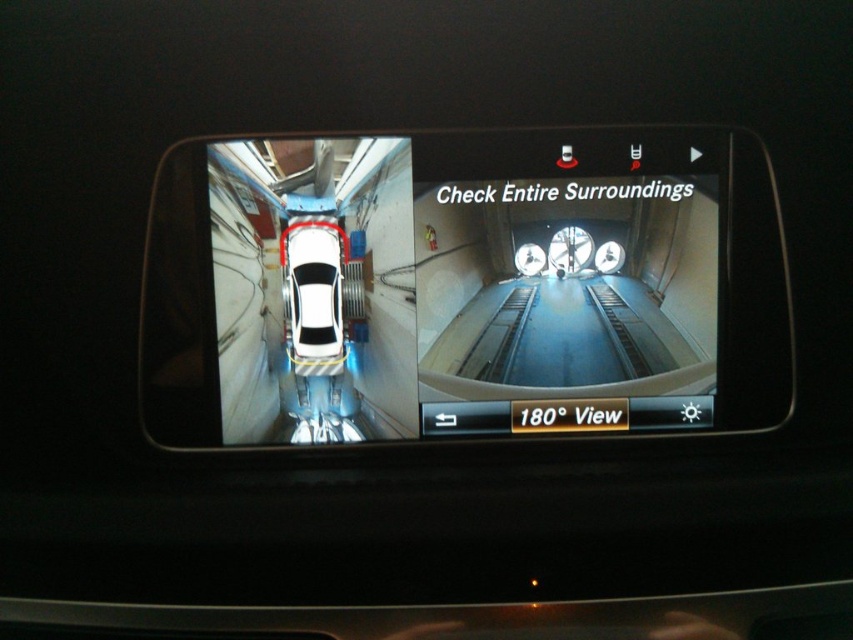
Question: Is transparent glass rearview mirror at center to the right of white matte car at center from the viewer's perspective?

Choices:
 (A) yes
 (B) no

Answer: (A)

Question: Which point appears farthest from the camera in this image?

Choices:
 (A) (140, 333)
 (B) (299, 264)

Answer: (B)

Question: Does transparent glass rearview mirror at center have a lesser width compared to white matte car at center?

Choices:
 (A) no
 (B) yes

Answer: (A)

Question: Does transparent glass rearview mirror at center appear under white matte car at center?

Choices:
 (A) no
 (B) yes

Answer: (A)